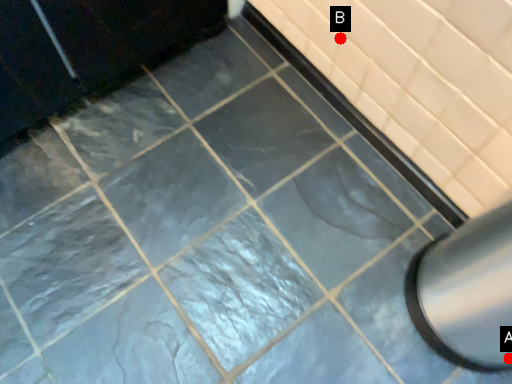
Question: Two points are circled on the image, labeled by A and B beside each circle. Which point is closer to the camera?

Choices:
 (A) A is closer
 (B) B is closer

Answer: (A)